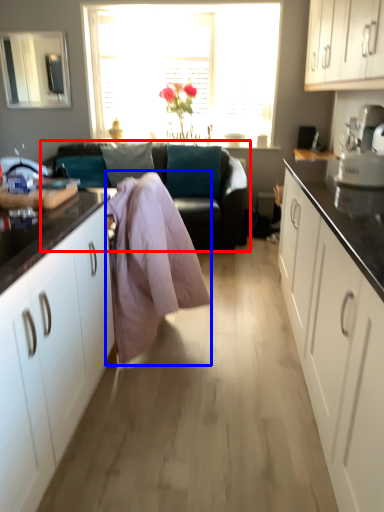
Question: Which object is further to the camera taking this photo, studio couch (highlighted by a red box) or blanket (highlighted by a blue box)?

Choices:
 (A) studio couch
 (B) blanket

Answer: (A)